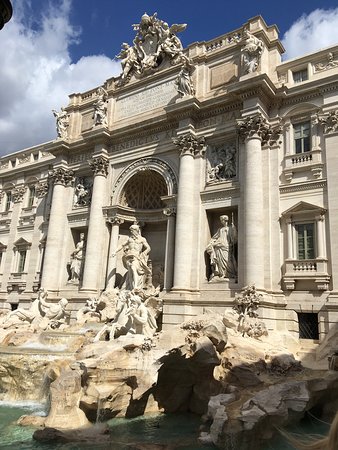
Where is `basement level`? basement level is located at coordinates (282, 321).